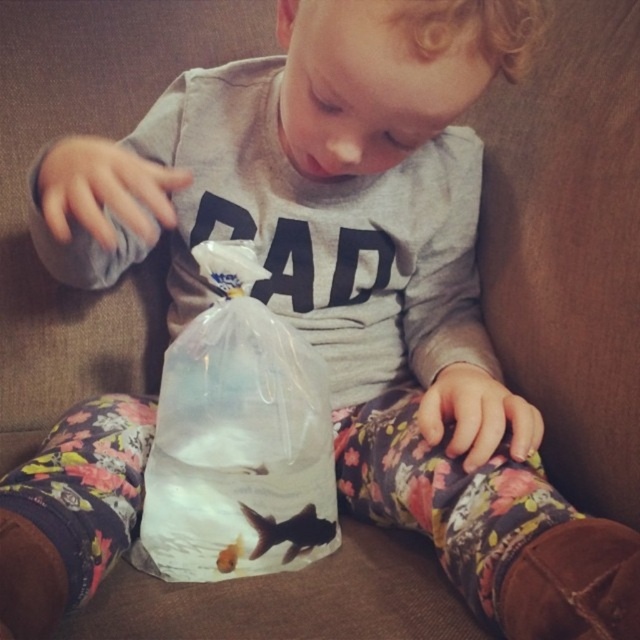
The child is holding a transparent plastic bag at center and a translucent plastic goldfish at center. Which object is taller?

The transparent plastic bag at center is taller than the translucent plastic goldfish at center.

What are the coordinates of the black matte fish at center?

The black matte fish at center is located at coordinates point (289, 531).

Please describe the position of the transparent plastic bag at center in the image using coordinates. The scene is a young child sitting on a brown couch, wearing a gray shirt with the word DAD, and looking at a clear plastic bag with two fish. The bag is on their lap. The coordinates are based on the image frame, where the bottom left corner is the origin point. The first number is the horizontal axis from left to right, and the second number is the vertical axis from bottom to top. The answer should be in

The transparent plastic bag at center is located at coordinates approximately 0.686 on the horizontal axis and 0.372 on the vertical axis.